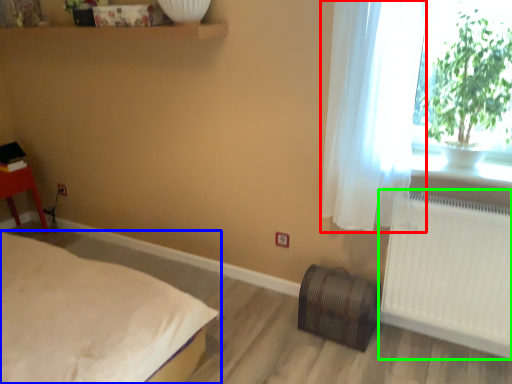
Question: Considering the real-world distances, which object is farthest from curtain (highlighted by a red box)? bed (highlighted by a blue box) or radiator (highlighted by a green box)?

Choices:
 (A) bed
 (B) radiator

Answer: (A)